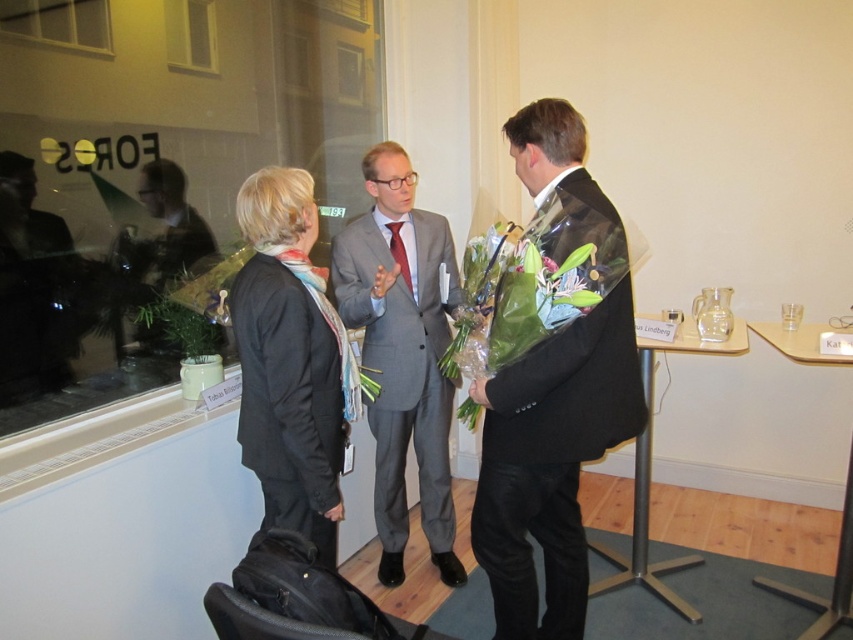
Is clear glass window at upper left shorter than green leafy bouquet at center?

Incorrect, clear glass window at upper left's height does not fall short of green leafy bouquet at center's.

In the scene shown: Can you confirm if clear glass window at upper left is wider than green leafy bouquet at center?

Yes.

The width and height of the screenshot is (853, 640). Describe the element at coordinates (190, 35) in the screenshot. I see `clear glass window at upper left` at that location.

Identify the location of clear glass window at upper left. The height and width of the screenshot is (640, 853). (190, 35).

Is black woolen suit at center thinner than green leafy bouquet at center?

No.

Based on the photo, who is more forward, (247, 310) or (554, 268)?

Point (554, 268) is in front.

Between point (292, 444) and point (544, 257), which one is positioned in front?

Point (544, 257)

Locate an element on the screen. black woolen suit at center is located at coordinates (289, 360).

Based on the photo, does transparent glass window at upper left have a greater width compared to clear glass window at upper left?

Indeed, transparent glass window at upper left has a greater width compared to clear glass window at upper left.

What do you see at coordinates (59, 22) in the screenshot? I see `transparent glass window at upper left` at bounding box center [59, 22].

Identify the location of transparent glass window at upper left. This screenshot has width=853, height=640. (59, 22).